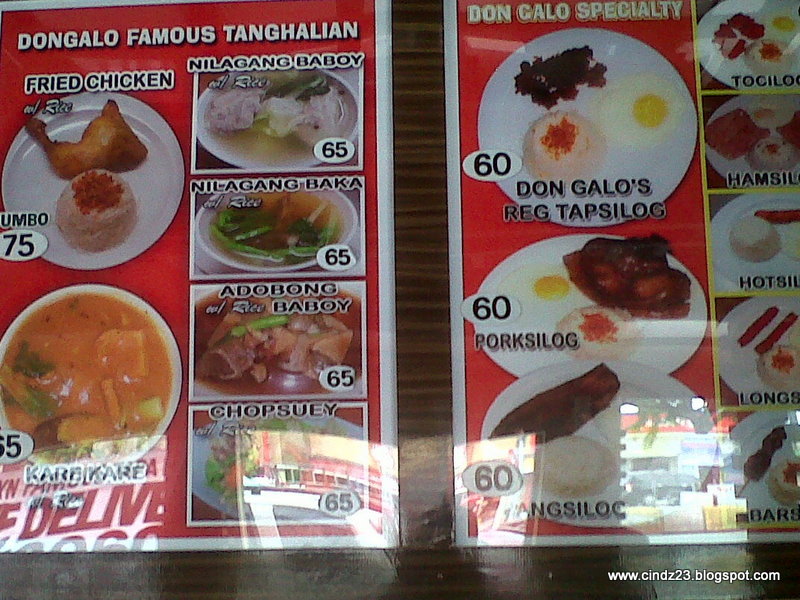
Where is `bowls`? bowls is located at coordinates (250, 248), (169, 346), (214, 383).